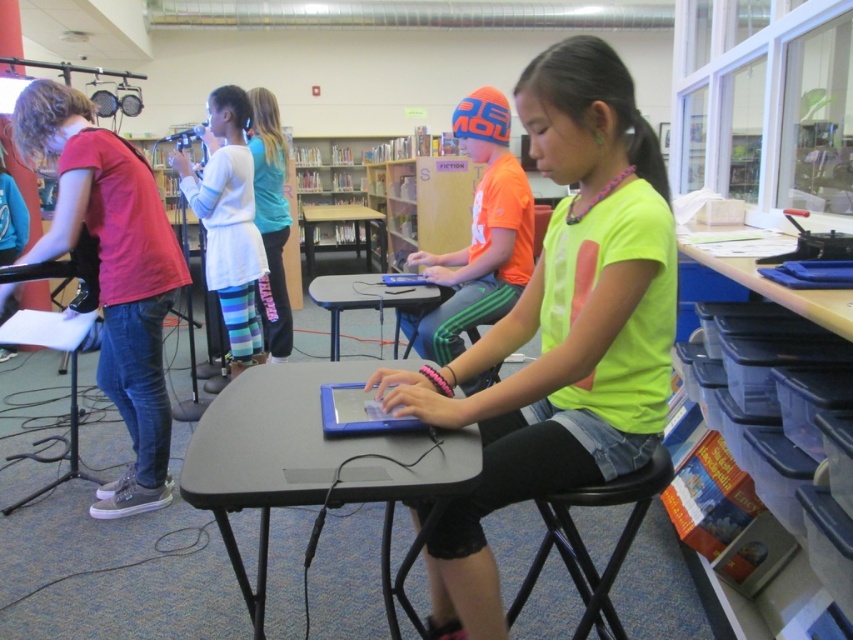
Is matte red shirt at left taller than smooth plastic table at center?

Yes.

Is point (132, 243) farther from viewer compared to point (430, 285)?

No, (132, 243) is in front of (430, 285).

Who is more distant from viewer, [132,410] or [329,307]?

The point [132,410] is behind.

This screenshot has width=853, height=640. What are the coordinates of `matte red shirt at left` in the screenshot? It's located at (x=112, y=272).

Is white cotton hoodie at upper center positioned at the back of smooth plastic table at center?

Yes.

Between white cotton hoodie at upper center and smooth plastic table at center, which one has less height?

→ With less height is smooth plastic table at center.

Which is in front, point (276, 140) or point (428, 301)?

Point (428, 301)

In order to click on white cotton hoodie at upper center in this screenshot , I will do `click(270, 220)`.

At what (x,y) coordinates should I click in order to perform the action: click on gray plastic table at center. Please return your answer as a coordinate pair (x, y). Looking at the image, I should click on (312, 465).

Describe the element at coordinates (312, 465) in the screenshot. I see `gray plastic table at center` at that location.

Where is `gray plastic table at center`? gray plastic table at center is located at coordinates (312, 465).

Where is `gray plastic table at center`? This screenshot has height=640, width=853. gray plastic table at center is located at coordinates click(312, 465).